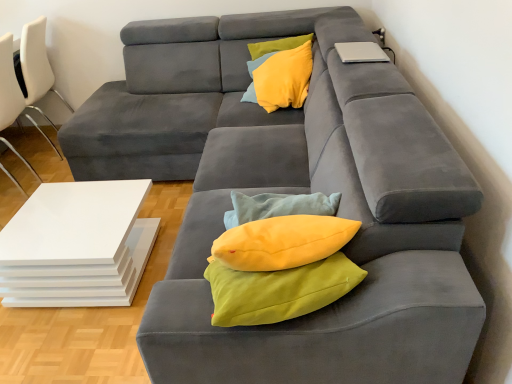
Question: Is yellow fabric pillow at upper center taller than white plastic chair at left, the second chair viewed from the back?

Choices:
 (A) yes
 (B) no

Answer: (B)

Question: Can you confirm if yellow fabric pillow at upper center is thinner than white plastic chair at left, which is the 1th chair from front to back?

Choices:
 (A) yes
 (B) no

Answer: (A)

Question: Is the position of yellow fabric pillow at upper center less distant than that of white plastic chair at left, which is the 1th chair from front to back?

Choices:
 (A) yes
 (B) no

Answer: (B)

Question: Is white plastic chair at left, which is the 1th chair from front to back, a part of yellow fabric pillow at upper center?

Choices:
 (A) no
 (B) yes

Answer: (A)

Question: From a real-world perspective, is yellow fabric pillow at upper center beneath white plastic chair at left, the second chair viewed from the back?

Choices:
 (A) yes
 (B) no

Answer: (B)

Question: Is yellow fabric pillow at upper center at the left side of white plastic chair at left, which is the 1th chair from front to back?

Choices:
 (A) yes
 (B) no

Answer: (B)

Question: Would you say silver metallic laptop at upper right is part of white glossy table at lower left's contents?

Choices:
 (A) yes
 (B) no

Answer: (B)

Question: Is white glossy table at lower left next to silver metallic laptop at upper right?

Choices:
 (A) yes
 (B) no

Answer: (B)

Question: Can you confirm if white glossy table at lower left is positioned to the right of silver metallic laptop at upper right?

Choices:
 (A) no
 (B) yes

Answer: (A)

Question: Considering the relative sizes of white glossy table at lower left and silver metallic laptop at upper right in the image provided, is white glossy table at lower left smaller than silver metallic laptop at upper right?

Choices:
 (A) yes
 (B) no

Answer: (B)

Question: Does white glossy table at lower left lie behind silver metallic laptop at upper right?

Choices:
 (A) no
 (B) yes

Answer: (A)

Question: Does white glossy table at lower left lie in front of silver metallic laptop at upper right?

Choices:
 (A) yes
 (B) no

Answer: (A)

Question: Is white glossy table at lower left shorter than yellow fabric pillow at upper center?

Choices:
 (A) yes
 (B) no

Answer: (B)